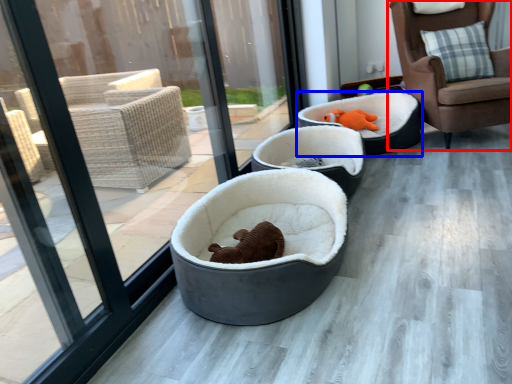
Question: Which point is closer to the camera, chair (highlighted by a red box) or dog bed (highlighted by a blue box)?

Choices:
 (A) chair
 (B) dog bed

Answer: (A)